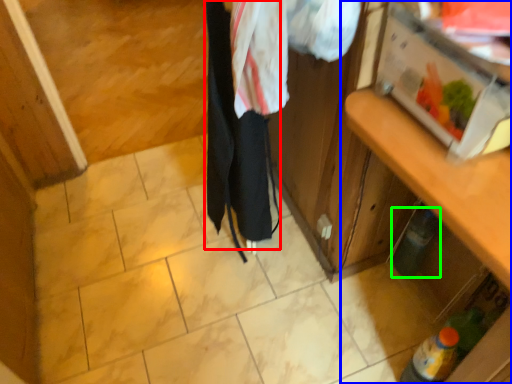
Question: Considering the real-world distances, which object is closest to clothing (highlighted by a red box)? cabinetry (highlighted by a blue box) or bottle (highlighted by a green box).

Choices:
 (A) cabinetry
 (B) bottle

Answer: (A)